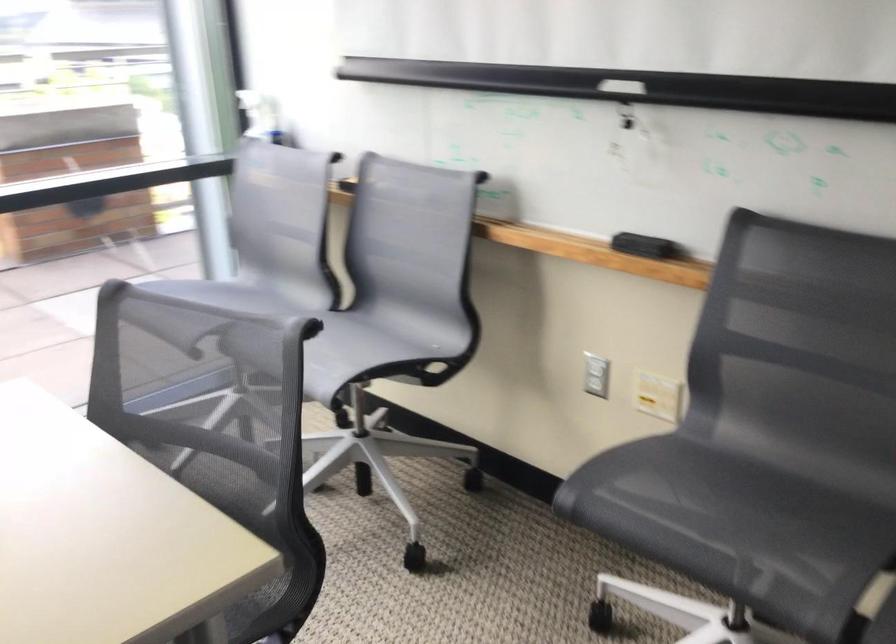
Locate an element on the screen. white light switch is located at coordinates (596, 375).